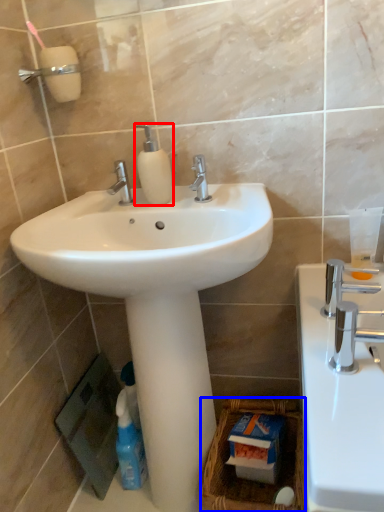
Question: Which object is further to the camera taking this photo, soap dispenser (highlighted by a red box) or basket (highlighted by a blue box)?

Choices:
 (A) soap dispenser
 (B) basket

Answer: (A)